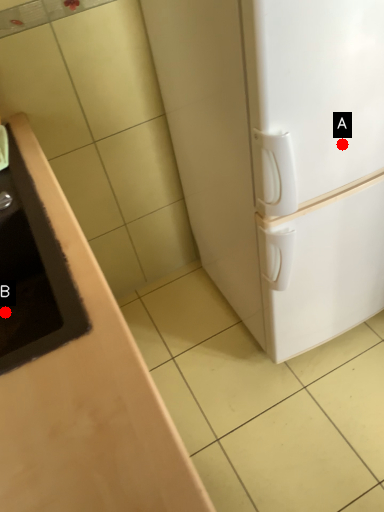
Question: Two points are circled on the image, labeled by A and B beside each circle. Which of the following is the closest to the observer?

Choices:
 (A) A is closer
 (B) B is closer

Answer: (B)